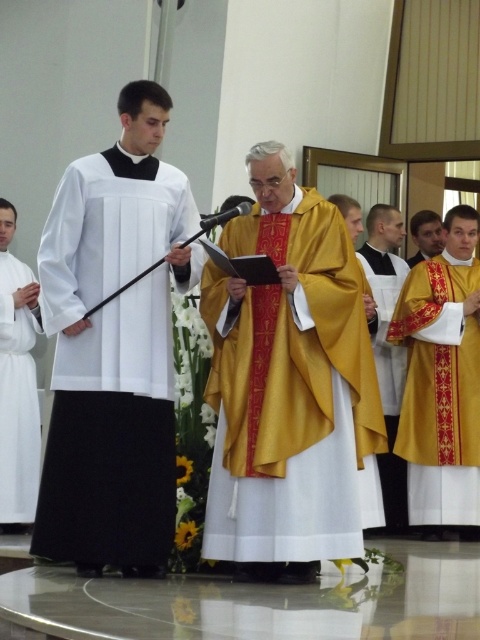
Question: Is gold satin robe at center to the right of gold satin robe at right from the viewer's perspective?

Choices:
 (A) no
 (B) yes

Answer: (A)

Question: Which point is closer to the camera?

Choices:
 (A) (448, 436)
 (B) (324, 355)

Answer: (B)

Question: Which object is farther from the camera taking this photo?

Choices:
 (A) white matte robe at left
 (B) gold embroidered robe at right
 (C) gold satin robe at center
 (D) white pleated fabric at center

Answer: (B)

Question: Is the position of white matte robe at left less distant than that of gold satin robe at right?

Choices:
 (A) yes
 (B) no

Answer: (A)

Question: Where is gold embroidered robe at right located in relation to white matte robe at left in the image?

Choices:
 (A) right
 (B) left

Answer: (A)

Question: Which point is closer to the camera?

Choices:
 (A) (4, 388)
 (B) (392, 392)

Answer: (A)